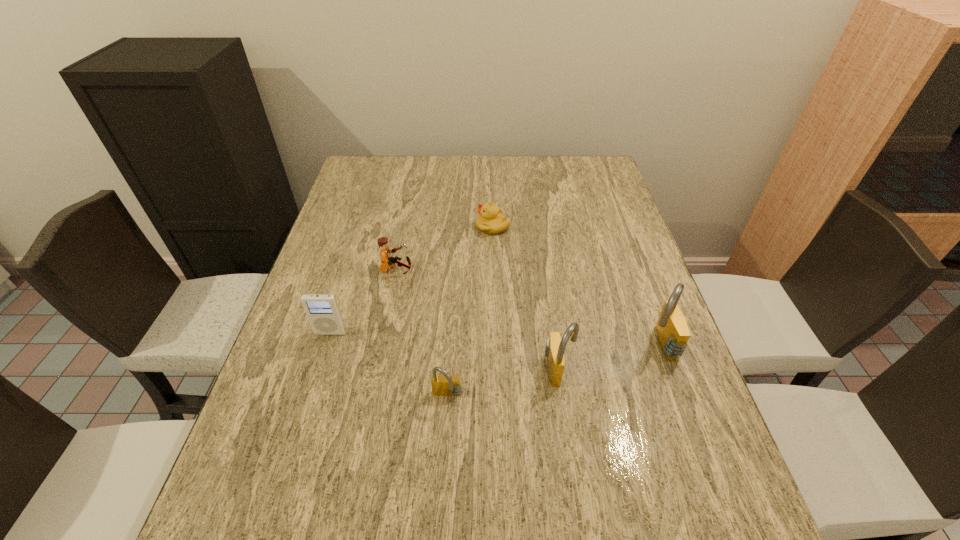
Identify the location of object that is the closest to the Lego. The width and height of the screenshot is (960, 540). (322, 310).

Point out which object is positioned as the nearest to the nearest object. Please provide its 2D coordinates. Your answer should be formatted as a tuple, i.e. [(x, y)], where the tuple contains the x and y coordinates of a point satisfying the conditions above.

[(555, 346)]

Locate which padlock is the closest to the third tallest object. Please provide its 2D coordinates. Your answer should be formatted as a tuple, i.e. [(x, y)], where the tuple contains the x and y coordinates of a point satisfying the conditions above.

[(442, 385)]

Where is `padlock that is the second closest to the shortest padlock`? The height and width of the screenshot is (540, 960). padlock that is the second closest to the shortest padlock is located at coordinates (673, 334).

The image size is (960, 540). Identify the location of vacant space that satisfies the following two spatial constraints: 1. on the front-facing side of the duckling; 2. on the side with the combination dials of the nearest object. [x=498, y=396].

Where is `free space that satisfies the following two spatial constraints: 1. on the front-facing side of the duckling; 2. on the side with the combination dials of the shortest padlock`? The height and width of the screenshot is (540, 960). free space that satisfies the following two spatial constraints: 1. on the front-facing side of the duckling; 2. on the side with the combination dials of the shortest padlock is located at coordinates (498, 396).

Find the location of a particular element. The height and width of the screenshot is (540, 960). free space that satisfies the following two spatial constraints: 1. holding a crossbow in the hands of the Lego; 2. on the front-facing side of the third tallest object is located at coordinates (384, 333).

Find the location of a particular element. vacant space that satisfies the following two spatial constraints: 1. on the side with the combination dials of the second object from right to left; 2. on the side with the combination dials of the shortest padlock is located at coordinates (563, 396).